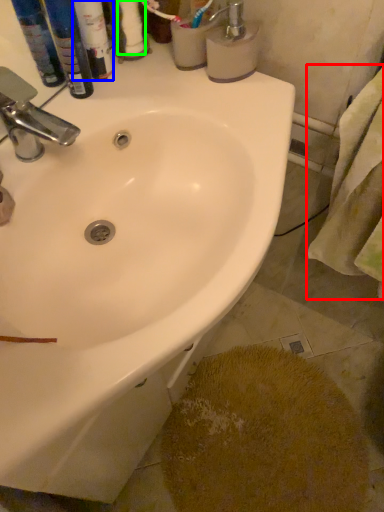
Question: Based on their relative distances, which object is nearer to bath towel (highlighted by a red box)? Choose from toiletry (highlighted by a blue box) and toilet paper (highlighted by a green box).

Choices:
 (A) toiletry
 (B) toilet paper

Answer: (B)